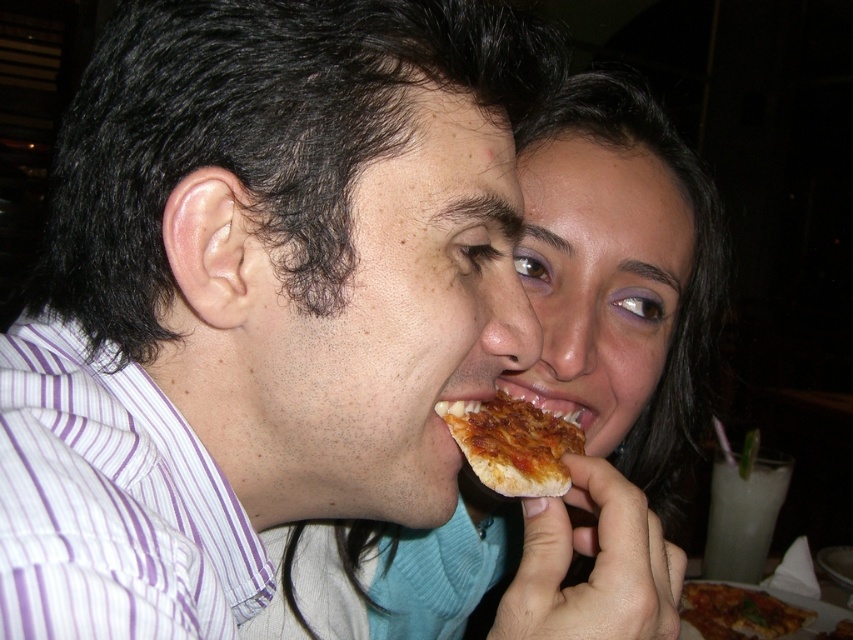
Looking at this image, can you confirm if smooth teal sweater at center is positioned to the right of golden crispy pizza at lower right?

In fact, smooth teal sweater at center is to the left of golden crispy pizza at lower right.

Between point (646, 333) and point (750, 604), which one is positioned in front?

Point (646, 333) is more forward.

Image resolution: width=853 pixels, height=640 pixels. Find the location of `smooth teal sweater at center`. smooth teal sweater at center is located at coordinates (619, 276).

Describe the element at coordinates (256, 296) in the screenshot. I see `purple striped shirt at center` at that location.

Does purple striped shirt at center appear on the left side of golden crispy pizza slice at mouth?

Yes, purple striped shirt at center is to the left of golden crispy pizza slice at mouth.

Does point (358, 157) lie in front of point (495, 460)?

Yes.

Find the location of `purple striped shirt at center`. purple striped shirt at center is located at coordinates (256, 296).

Can you confirm if smooth teal sweater at center is shorter than golden crispy pizza slice at mouth?

Incorrect, smooth teal sweater at center's height does not fall short of golden crispy pizza slice at mouth's.

Is point (525, 230) behind point (483, 410)?

Yes, it is.

Between point (566, 96) and point (517, 458), which one is positioned behind?

Point (566, 96)

Where is `smooth teal sweater at center`? Image resolution: width=853 pixels, height=640 pixels. smooth teal sweater at center is located at coordinates (619, 276).